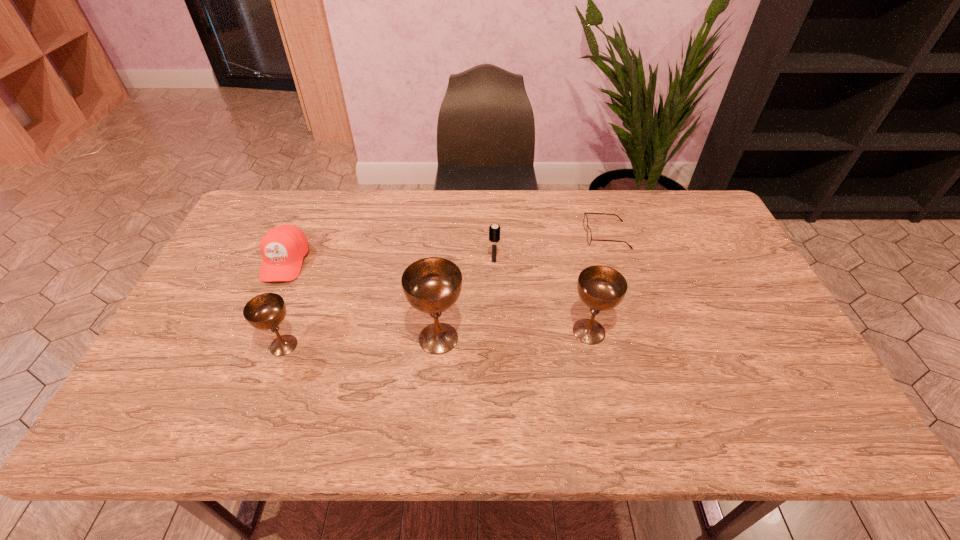
Please point a free position for a chalice on the right. Please provide its 2D coordinates. Your answer should be formatted as a tuple, i.e. [(x, y)], where the tuple contains the x and y coordinates of a point satisfying the conditions above.

[(735, 325)]